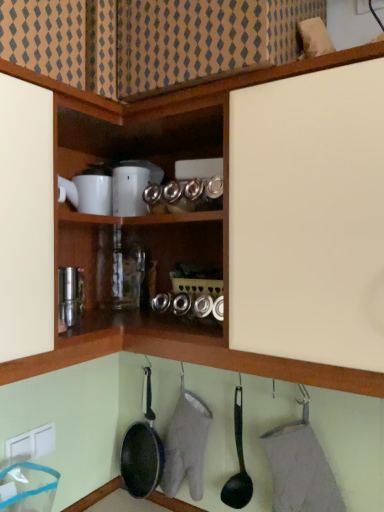
Question: Is black plastic frying pan at lower center, placed as the 1th frying pan when sorted from front to back, wider or thinner than black non-stick frying pan at lower center, the 2th frying pan viewed from the front?

Choices:
 (A) wide
 (B) thin

Answer: (B)

Question: Considering their positions, is black plastic frying pan at lower center, placed as the first frying pan when sorted from right to left, located in front of or behind black non-stick frying pan at lower center, which ranks as the 1th frying pan in left-to-right order?

Choices:
 (A) front
 (B) behind

Answer: (A)

Question: Based on their relative distances, which object is farther from the white plastic electric outlet at lower left?

Choices:
 (A) black non-stick frying pan at lower center, which is counted as the first frying pan, starting from the back
 (B) white glossy coffee maker at upper center
 (C) black plastic frying pan at lower center, placed as the 1th frying pan when sorted from front to back

Answer: (B)

Question: Which of these objects is positioned farthest from the black non-stick frying pan at lower center, which is counted as the first frying pan, starting from the back?

Choices:
 (A) white plastic electric outlet at lower left
 (B) white glossy coffee maker at upper center
 (C) black plastic frying pan at lower center, the second frying pan positioned from the left

Answer: (B)